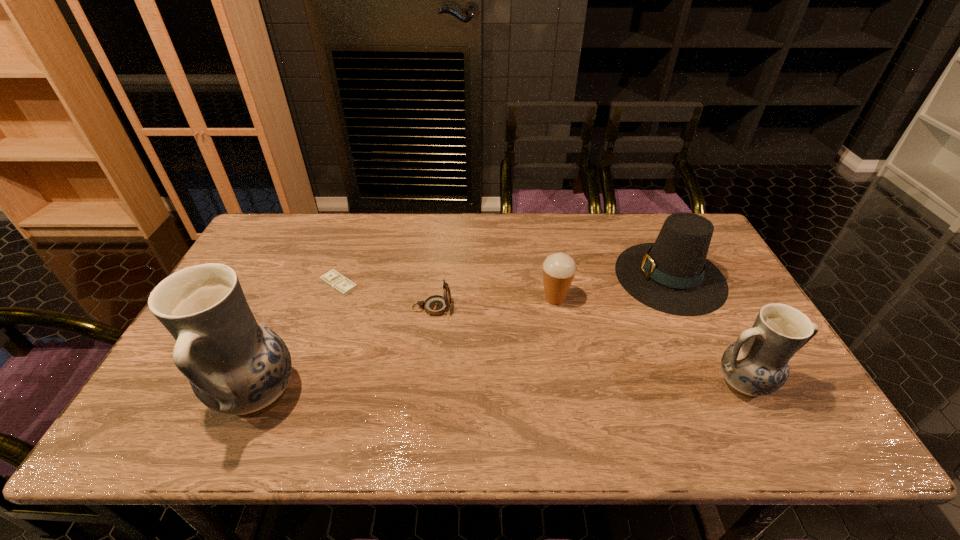
Where is `blank space that satisfies the following two spatial constraints: 1. on the face of the compass; 2. on the front side of the taller pottery`? blank space that satisfies the following two spatial constraints: 1. on the face of the compass; 2. on the front side of the taller pottery is located at coordinates (422, 395).

This screenshot has height=540, width=960. I want to click on free location that satisfies the following two spatial constraints: 1. on the front side of the money; 2. on the left side of the right pottery, so click(305, 383).

The image size is (960, 540). What are the coordinates of `blank space that satisfies the following two spatial constraints: 1. on the front side of the right pottery; 2. on the left side of the icecream` in the screenshot? It's located at 570,383.

I want to click on vacant space that satisfies the following two spatial constraints: 1. on the face of the shorter pottery; 2. on the left side of the fourth object from right to left, so click(423, 383).

Find the location of `free space that satisfies the following two spatial constraints: 1. on the front side of the right pottery; 2. on the right side of the shortest object`. free space that satisfies the following two spatial constraints: 1. on the front side of the right pottery; 2. on the right side of the shortest object is located at coordinates [x=305, y=383].